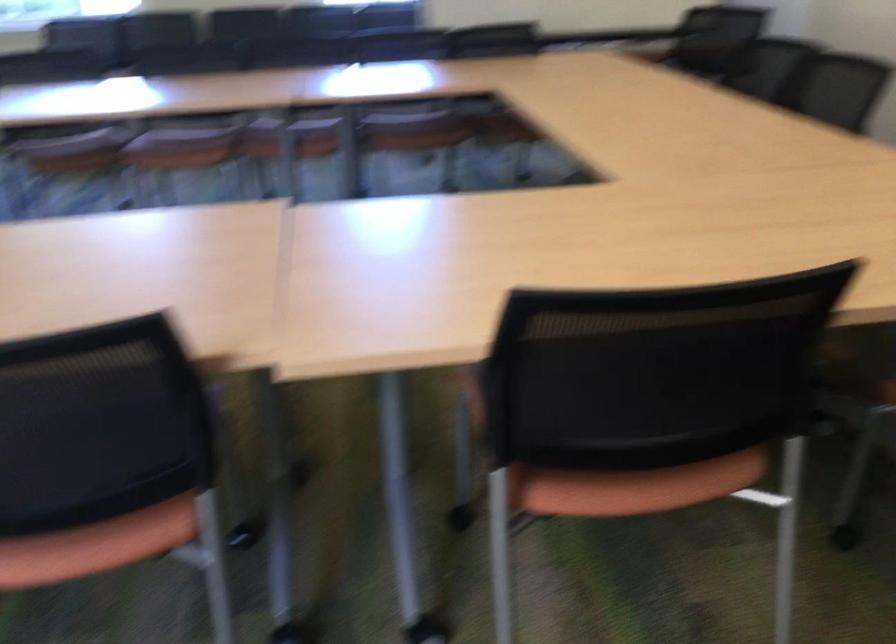
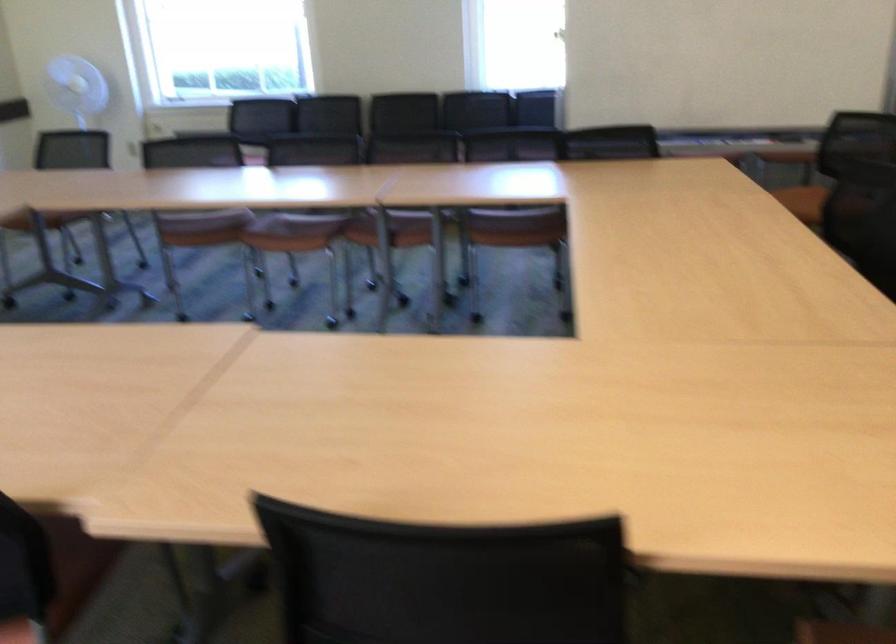
Question: The camera is either moving clockwise (left) or counter-clockwise (right) around the object. The first image is from the beginning of the video and the second image is from the end. Is the camera moving left or right when shooting the video?

Choices:
 (A) Left
 (B) Right

Answer: (B)